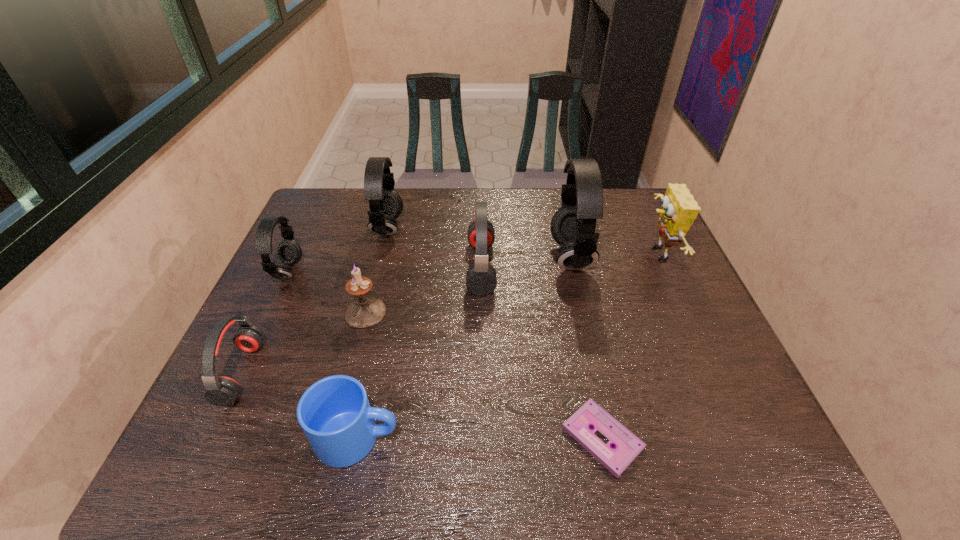
Find the location of a particular element. This screenshot has width=960, height=540. earphone at the far edge is located at coordinates (386, 205).

You are a GUI agent. You are given a task and a screenshot of the screen. Output one action in this format:
    pyautogui.click(x=<x>, y=<y>)
    Task: Click on the sponge located in the far edge section of the desktop
    The image size is (960, 540).
    Given the screenshot: What is the action you would take?
    pyautogui.click(x=679, y=209)

Where is `mug that is at the near edge`? mug that is at the near edge is located at coordinates (334, 413).

The width and height of the screenshot is (960, 540). Identify the location of videotape at the near edge. (627, 446).

Locate an element on the screen. object that is at the right edge is located at coordinates tap(679, 209).

Locate an element on the screen. object at the far right corner is located at coordinates (679, 209).

In the image, there is a desktop. Identify the location of vacant space at the far edge. (413, 190).

You are a GUI agent. You are given a task and a screenshot of the screen. Output one action in this format:
    pyautogui.click(x=<x>, y=<y>)
    Task: Click on the vacant space at the near edge of the desktop
    
    Given the screenshot: What is the action you would take?
    pyautogui.click(x=297, y=462)

Find the location of a particular element. The image size is (960, 540). free space at the left edge of the desktop is located at coordinates (263, 307).

In the image, there is a desktop. Identify the location of blank space at the right edge. (695, 342).